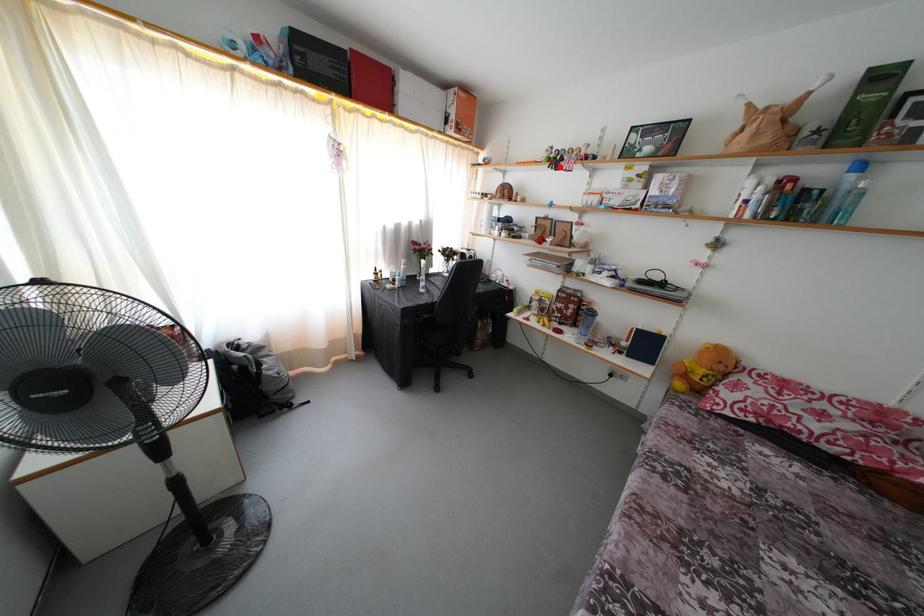
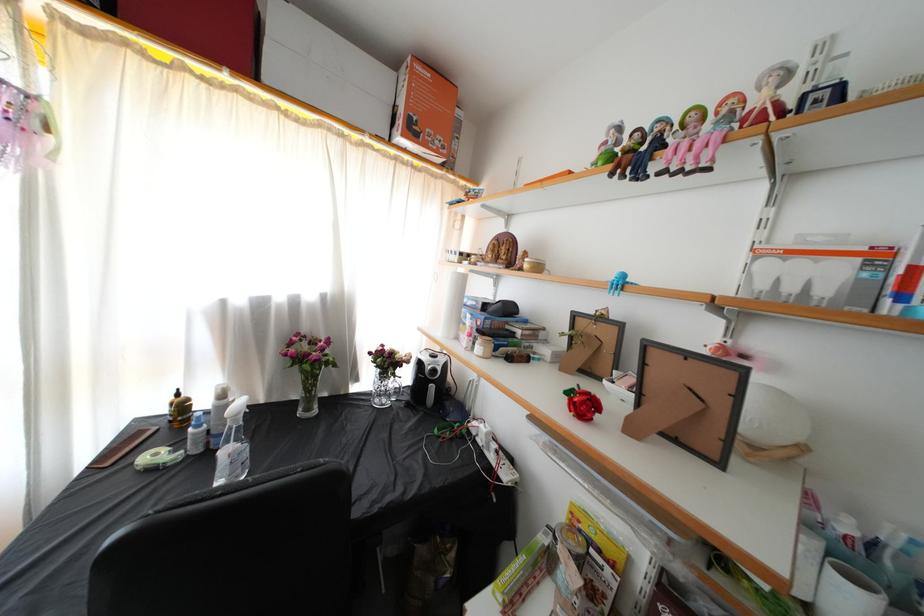
The point at the highlighted location is marked in the first image. Where is the corresponding point in the second image?

(638, 161)